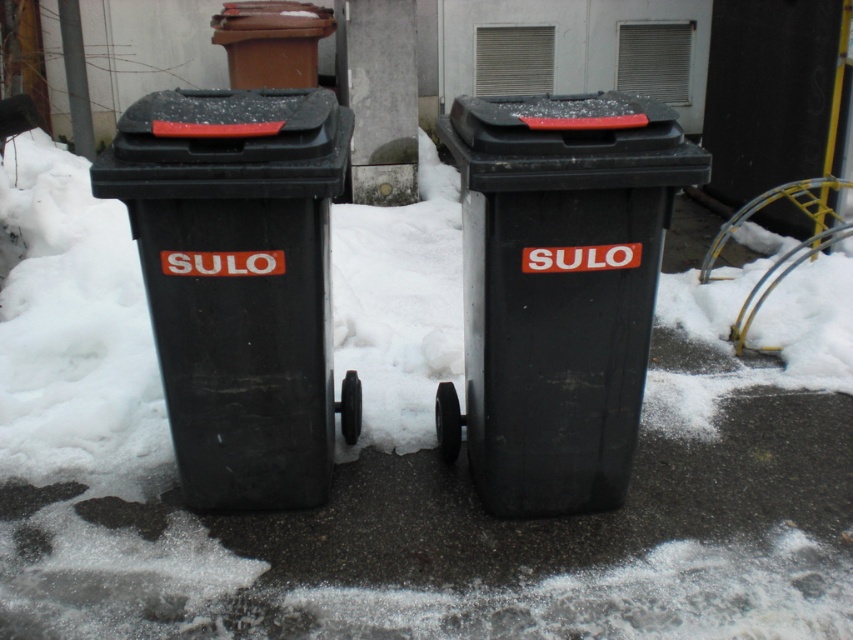
You are standing in a snowy area and want to place a small potted plant exactly at the point marked as point (593, 465). Considering the snow depth here is 15 cm, will the plant be visible above the snow?

The distance of point (593, 465) from viewer is 2.78 meters. Since the snow depth is 15 cm, the plant placed at this point will be visible above the snow as long as its height exceeds 15 cm. However, the question does not specify the plant height, so visibility cannot be definitively determined based on the given information.

You are standing at the origin point of the coordinate system. You want to move towards the black plastic recycling bin at center. What direction should you move in?

You should move towards the coordinates point (560,289) to reach the black plastic recycling bin at center.